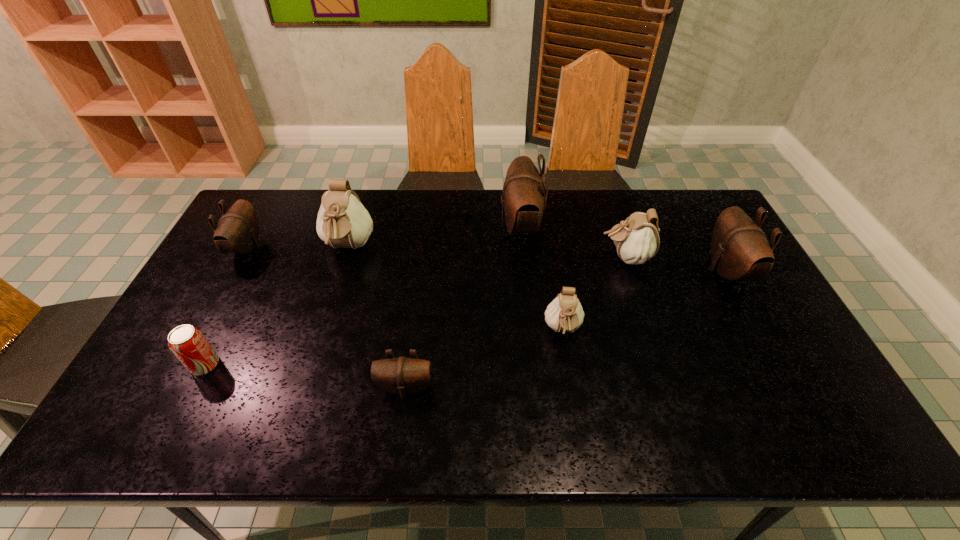
The image size is (960, 540). I want to click on the third brown pouch from left to right, so click(524, 197).

At what (x,y) coordinates should I click in order to perform the action: click on the third object from left to right. Please return your answer as a coordinate pair (x, y). Image resolution: width=960 pixels, height=540 pixels. Looking at the image, I should click on (343, 222).

This screenshot has width=960, height=540. I want to click on the leftmost white pouch, so click(x=343, y=222).

Locate an element on the screen. The height and width of the screenshot is (540, 960). the rightmost pouch is located at coordinates (739, 248).

In order to click on the rightmost brown pouch in this screenshot , I will do `click(739, 248)`.

Identify the location of the second biggest white pouch. Image resolution: width=960 pixels, height=540 pixels. (636, 239).

This screenshot has width=960, height=540. I want to click on the second object from right to left, so [636, 239].

Where is `the leftmost pouch`? the leftmost pouch is located at coordinates (237, 232).

Where is `the leftmost brown pouch`? the leftmost brown pouch is located at coordinates (237, 232).

The height and width of the screenshot is (540, 960). I want to click on the smallest white pouch, so click(x=564, y=314).